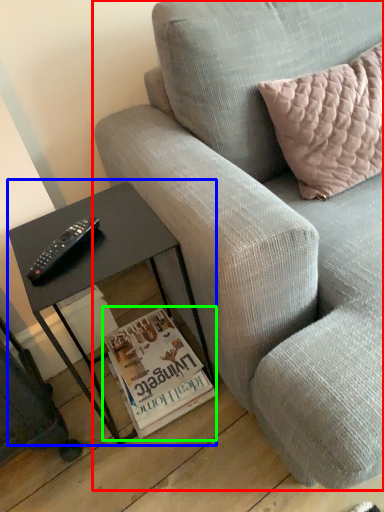
Question: Which object is the closest to the studio couch (highlighted by a red box)? Choose among these: table (highlighted by a blue box) or magazine (highlighted by a green box).

Choices:
 (A) table
 (B) magazine

Answer: (A)